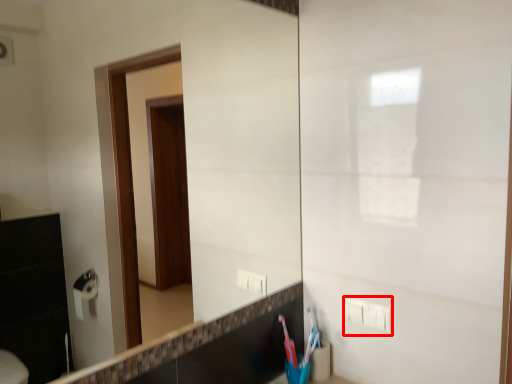
Question: From the image's perspective, considering the relative positions of electric outlet (annotated by the red box) and toothbrush in the image provided, where is electric outlet (annotated by the red box) located with respect to the staircase?

Choices:
 (A) below
 (B) above

Answer: (B)